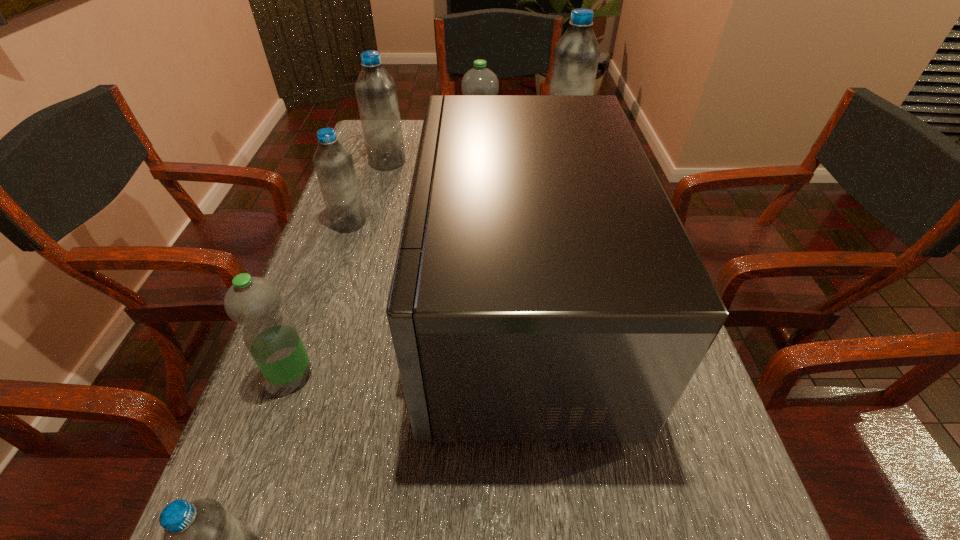
Locate which green water bottle ranks second in proximity to the microwave oven. Please provide its 2D coordinates. Your answer should be formatted as a tuple, i.e. [(x, y)], where the tuple contains the x and y coordinates of a point satisfying the conditions above.

[(479, 80)]

Identify the location of vacant region that satisfies the following two spatial constraints: 1. on the front side of the bigger green water bottle; 2. on the left side of the second biggest blue water bottle. (385, 173).

Identify the location of vacant space that satisfies the following two spatial constraints: 1. on the front-facing side of the microwave oven; 2. on the front side of the left green water bottle. The image size is (960, 540). (523, 375).